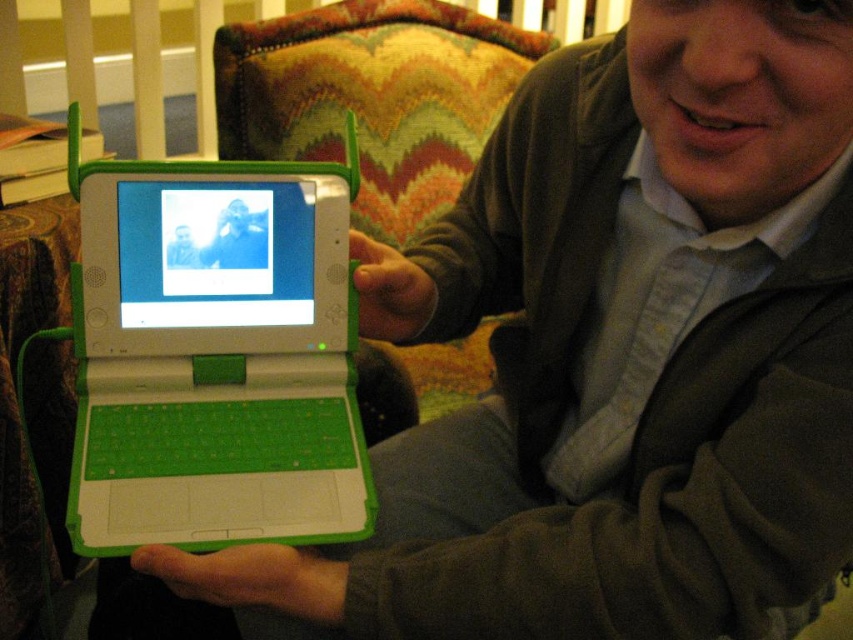
Question: Can you confirm if green plastic laptop at center is bigger than matte green laptop at center?

Choices:
 (A) no
 (B) yes

Answer: (B)

Question: Which object appears farthest from the camera in this image?

Choices:
 (A) matte green laptop at center
 (B) green plastic laptop at center

Answer: (A)

Question: Can you confirm if green plastic laptop at center is thinner than matte green laptop at center?

Choices:
 (A) yes
 (B) no

Answer: (B)

Question: Which of the following is the farthest from the observer?

Choices:
 (A) (265, 244)
 (B) (329, 428)

Answer: (A)

Question: Which of the following is the farthest from the observer?

Choices:
 (A) (238, 241)
 (B) (242, 524)

Answer: (A)

Question: Is green plastic laptop at center above matte green laptop at center?

Choices:
 (A) yes
 (B) no

Answer: (B)